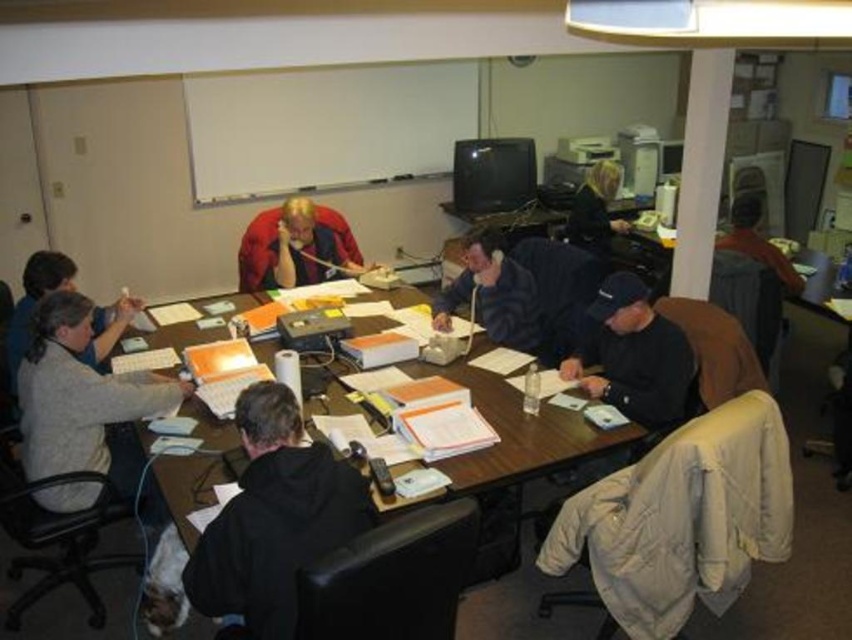
Question: Which point is closer to the camera?

Choices:
 (A) (507, 310)
 (B) (213, 560)

Answer: (B)

Question: Which point is closer to the camera?

Choices:
 (A) (280, 282)
 (B) (39, 278)
 (C) (505, 339)

Answer: (B)

Question: Does black hoodie at center appear on the left side of matte red jacket at center?

Choices:
 (A) yes
 (B) no

Answer: (B)

Question: Which is nearer to the gray sweater at left?

Choices:
 (A) dark gray sweater at center
 (B) dark blue shirt at upper right

Answer: (A)

Question: Is black hoodie at center bigger than light gray sweater at left?

Choices:
 (A) no
 (B) yes

Answer: (A)

Question: Is dark gray sweater at center above dark blue shirt at upper right?

Choices:
 (A) yes
 (B) no

Answer: (B)